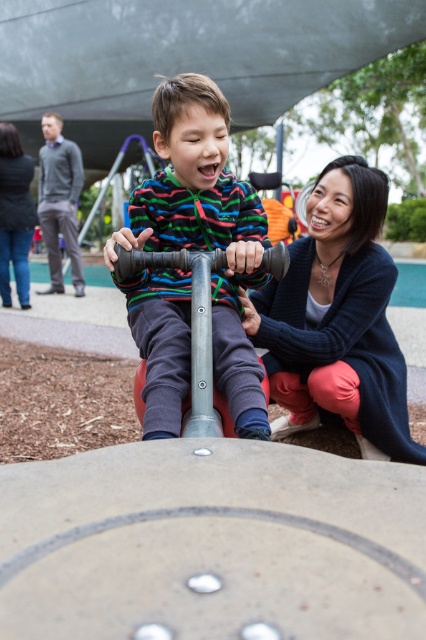
Which is more to the right, matte plastic scooter at center or blue sweater at center?

blue sweater at center is more to the right.

This screenshot has height=640, width=426. What do you see at coordinates (204, 227) in the screenshot? I see `matte plastic scooter at center` at bounding box center [204, 227].

Image resolution: width=426 pixels, height=640 pixels. I want to click on matte plastic scooter at center, so click(204, 227).

Is matte plastic scooter at center smaller than dark blue sweater at lower right?

Yes.

Between point (143, 204) and point (5, 260), which one is positioned in front?

Point (143, 204) is more forward.

Find the location of a particular element. matte plastic scooter at center is located at coordinates (204, 227).

In the scene shown: Can you confirm if blue sweater at center is positioned to the right of dark blue sweater at lower right?

Indeed, blue sweater at center is positioned on the right side of dark blue sweater at lower right.

Does blue sweater at center have a lesser width compared to dark blue sweater at lower right?

No, blue sweater at center is not thinner than dark blue sweater at lower right.

Who is more distant from viewer, (383, 353) or (19, 214)?

Point (19, 214)

Identify the location of blue sweater at center. The width and height of the screenshot is (426, 640). (336, 317).